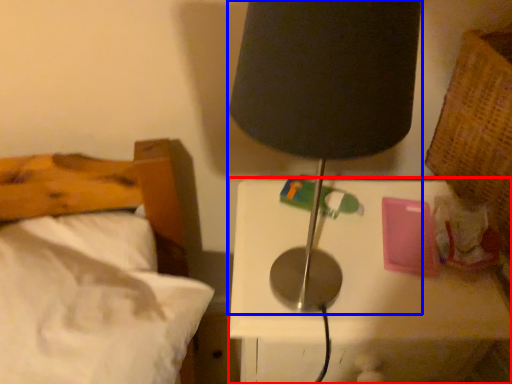
Question: Which point is further to the camera, nightstand (highlighted by a red box) or lamp (highlighted by a blue box)?

Choices:
 (A) nightstand
 (B) lamp

Answer: (A)